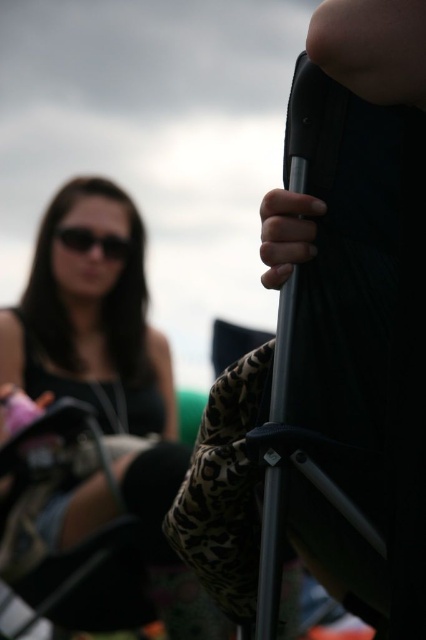
Question: Which point is farther from the camera taking this photo?

Choices:
 (A) (120, 259)
 (B) (146, 420)

Answer: (A)

Question: Is matte black tank top at left closer to the viewer compared to black matte sunglasses at upper left?

Choices:
 (A) no
 (B) yes

Answer: (B)

Question: Can you confirm if matte black tank top at left is wider than black matte sunglasses at upper left?

Choices:
 (A) no
 (B) yes

Answer: (B)

Question: Can you confirm if matte black tank top at left is wider than black matte sunglasses at upper left?

Choices:
 (A) no
 (B) yes

Answer: (B)